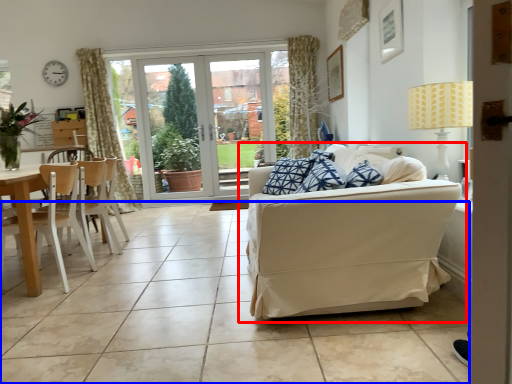
Question: Which of the following is the farthest to the observer, studio couch (highlighted by a red box) or ceramic tile (highlighted by a blue box)?

Choices:
 (A) studio couch
 (B) ceramic tile

Answer: (A)